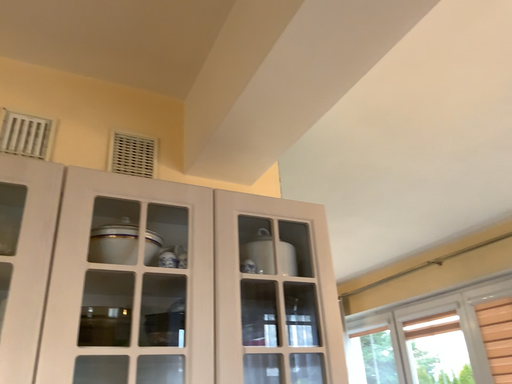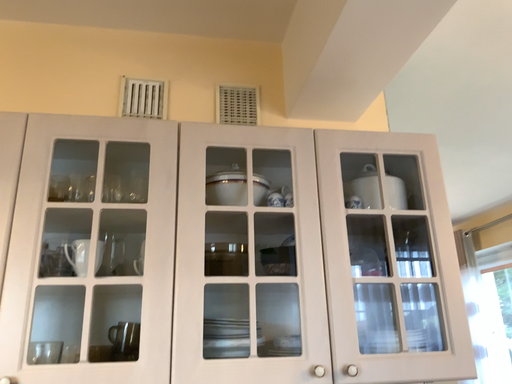
Question: Which way did the camera rotate in the video?

Choices:
 (A) rotated downward
 (B) rotated upward

Answer: (A)